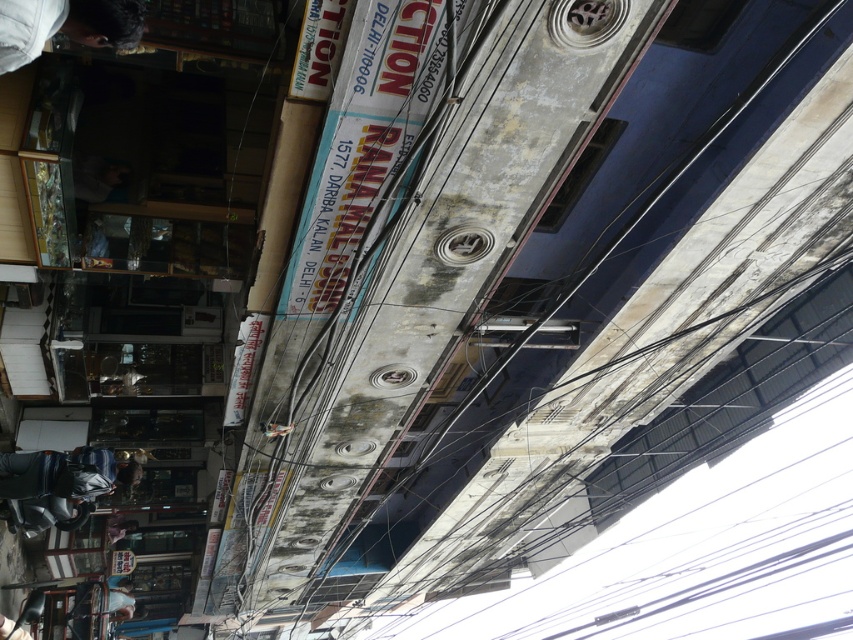
You are a photographer trying to capture the two points in the image. Which point, point (137, 36) or point (97, 474), will appear larger in your photo?

Point (137, 36) is closer to the camera than point (97, 474), so it will appear larger in the photo.

From the picture: You are a delivery person looking at the image. You need to determine which object takes up more space in the scene between the dark hair at upper left and the metallic helmet at lower left. Which one is larger in size?

The metallic helmet at lower left takes up more space than the dark hair at upper left because the dark hair at upper left occupies less space than metallic helmet at lower left.

Looking at this image, you are a delivery rider wearing a metallic helmet at lower left. You notice a cyclist with dark hair at upper left approaching from behind. To avoid collision, you need to move to the right. Is the cyclist likely to pass you on your left or right side?

The dark hair at upper left is located above metallic helmet at lower left, which means the cyclist is positioned higher in the image. Since you are at the lower left, the cyclist is approaching from behind and above, so they will likely pass you on your right side.